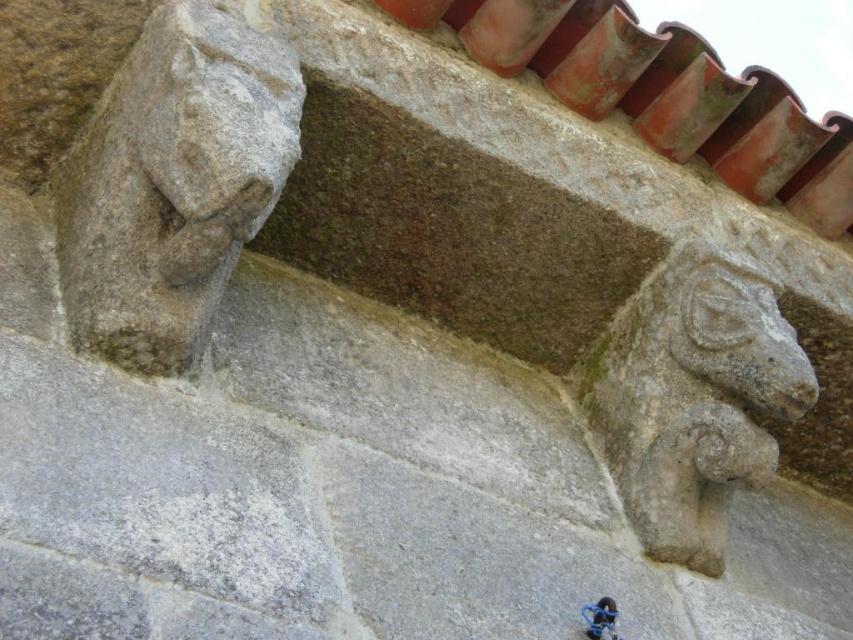
Which of these two, gray stone carving at upper left or gray stone ram at upper right, stands shorter?

Standing shorter between the two is gray stone carving at upper left.

Is gray stone carving at upper left thinner than gray stone ram at upper right?

No.

Which is behind, point (134, 241) or point (653, 547)?

The point (653, 547) is more distant.

Locate an element on the screen. The width and height of the screenshot is (853, 640). gray stone carving at upper left is located at coordinates (173, 182).

Between gray stone ram at upper right and blue metallic bicycle at lower right, which one is positioned higher?

Positioned higher is gray stone ram at upper right.

Which is in front, point (672, 365) or point (590, 614)?

Point (590, 614) is more forward.

Locate an element on the screen. This screenshot has width=853, height=640. gray stone ram at upper right is located at coordinates (692, 397).

Is gray stone carving at upper left positioned before blue metallic bicycle at lower right?

That is True.

In order to click on gray stone carving at upper left in this screenshot , I will do `click(173, 182)`.